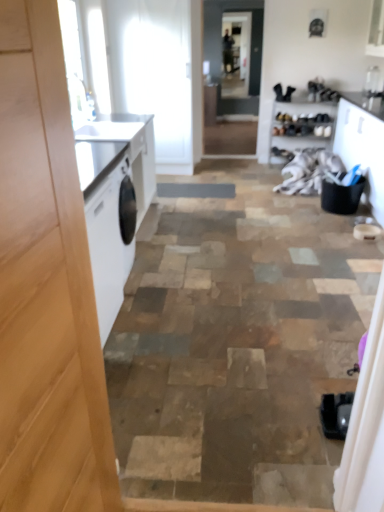
Question: Could you tell me if white fabric at center is turned towards clear glass screen door at center, which ranks as the first screen door in front-to-back order?

Choices:
 (A) yes
 (B) no

Answer: (B)

Question: Considering the relative positions of white fabric at center and clear glass screen door at center, which ranks as the first screen door in front-to-back order, in the image provided, is white fabric at center to the left of clear glass screen door at center, which ranks as the first screen door in front-to-back order, from the viewer's perspective?

Choices:
 (A) no
 (B) yes

Answer: (A)

Question: Does white fabric at center have a greater height compared to clear glass screen door at center, which ranks as the first screen door in front-to-back order?

Choices:
 (A) no
 (B) yes

Answer: (A)

Question: Is white fabric at center further to camera compared to clear glass screen door at center, which is the first screen door in bottom-to-top order?

Choices:
 (A) no
 (B) yes

Answer: (A)

Question: Is white fabric at center positioned before clear glass screen door at center, which is the first screen door in bottom-to-top order?

Choices:
 (A) no
 (B) yes

Answer: (B)

Question: Is white fabric at center positioned with its back to clear glass screen door at center, acting as the 2th screen door starting from the top?

Choices:
 (A) no
 (B) yes

Answer: (A)

Question: Can you confirm if clear glass screen door at center, which is the 2th screen door from front to back, is bigger than wooden shoe rack at upper right?

Choices:
 (A) yes
 (B) no

Answer: (B)

Question: Is clear glass screen door at center, which ranks as the 2th screen door in bottom-to-top order, positioned before wooden shoe rack at upper right?

Choices:
 (A) yes
 (B) no

Answer: (B)

Question: From a real-world perspective, is clear glass screen door at center, which ranks as the 2th screen door in bottom-to-top order, located beneath wooden shoe rack at upper right?

Choices:
 (A) yes
 (B) no

Answer: (B)

Question: From the image's perspective, would you say clear glass screen door at center, which is the 2th screen door from front to back, is shown under wooden shoe rack at upper right?

Choices:
 (A) yes
 (B) no

Answer: (B)

Question: Does clear glass screen door at center, arranged as the 1th screen door when viewed from the top, turn towards wooden shoe rack at upper right?

Choices:
 (A) yes
 (B) no

Answer: (A)

Question: Considering the relative sizes of clear glass screen door at center, which ranks as the 2th screen door in bottom-to-top order, and wooden shoe rack at upper right in the image provided, is clear glass screen door at center, which ranks as the 2th screen door in bottom-to-top order, taller than wooden shoe rack at upper right?

Choices:
 (A) yes
 (B) no

Answer: (A)

Question: Is clear glass screen door at center, the 1th screen door viewed from the back, oriented away from white fabric at center?

Choices:
 (A) no
 (B) yes

Answer: (A)